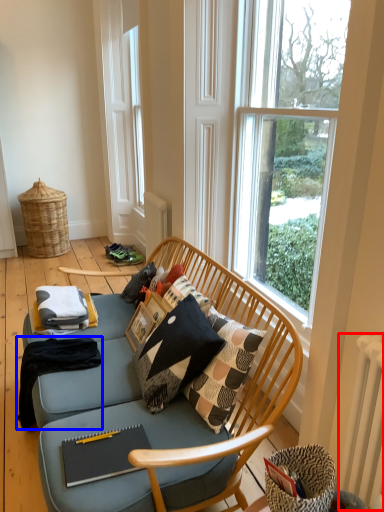
Question: Which point is closer to the camera, radiator (highlighted by a red box) or blanket (highlighted by a blue box)?

Choices:
 (A) radiator
 (B) blanket

Answer: (A)